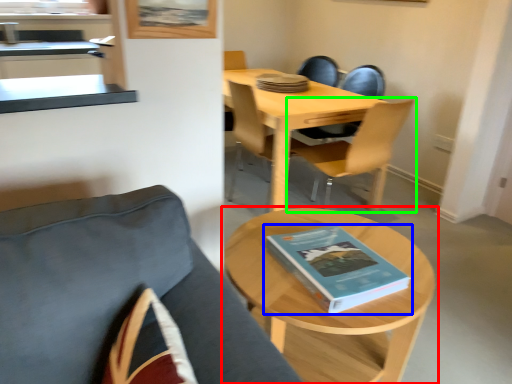
Question: Which object is the closest to the coffee table (highlighted by a red box)? Choose among these: book (highlighted by a blue box) or chair (highlighted by a green box).

Choices:
 (A) book
 (B) chair

Answer: (A)